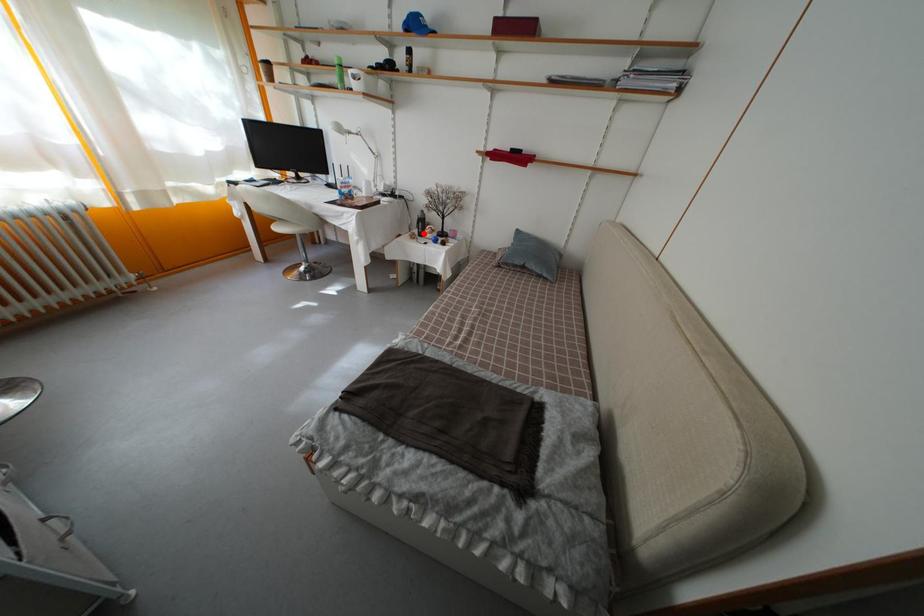
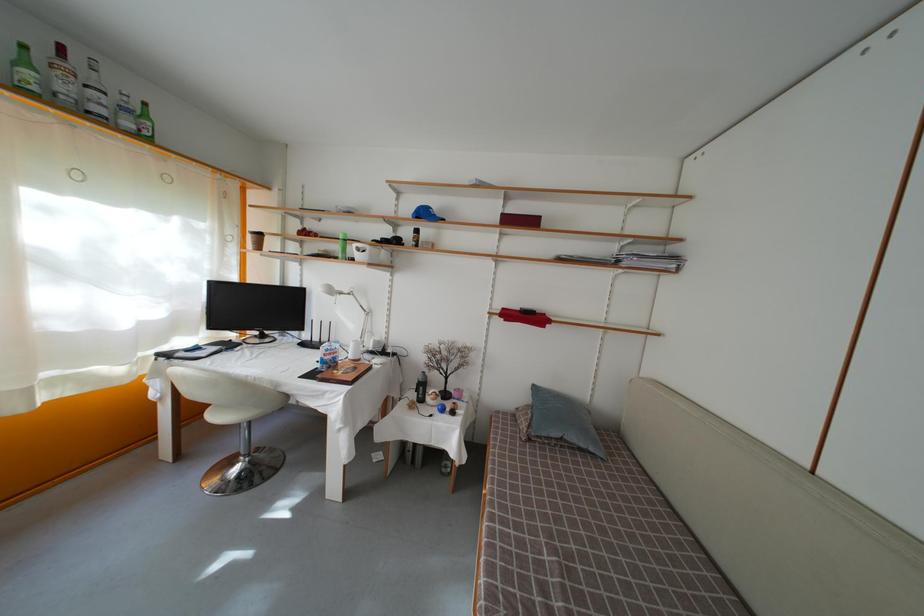
Question: I am providing you with two images of the same scene from different viewpoints. In image1, a red point is highlighted. Considering the same 3D point in image2, which of the following is correct?

Choices:
 (A) It is closer
 (B) It is farther

Answer: (B)